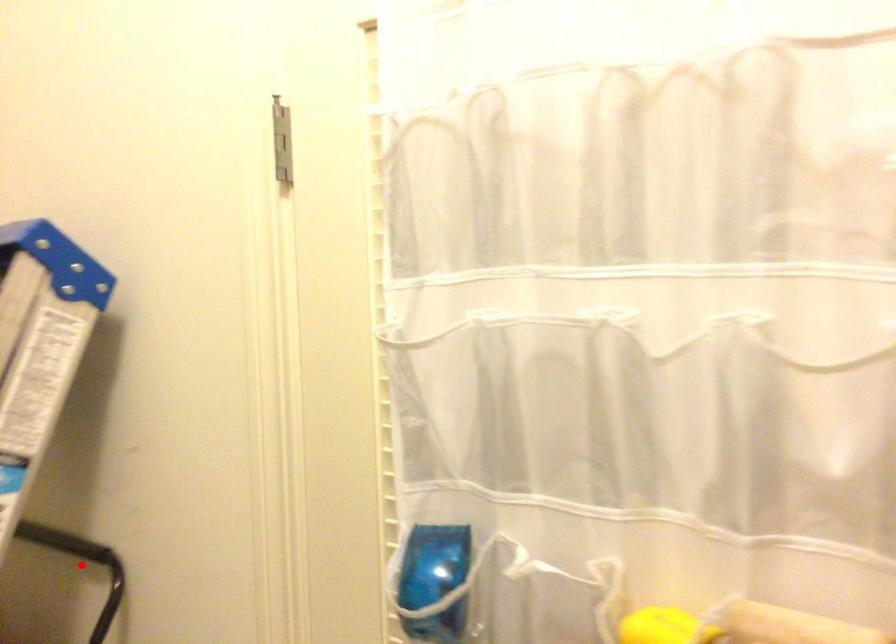
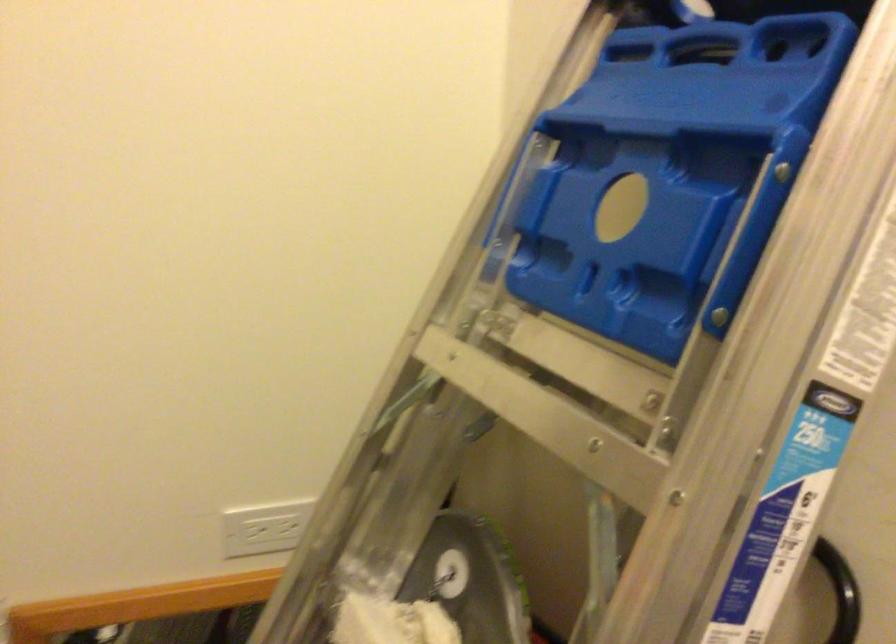
Question: I am providing you with two images of the same scene from different viewpoints. A red point is marked on the first image. At the location where the point appears in image 1, is it still visible in image 2?

Choices:
 (A) Yes
 (B) No

Answer: (B)